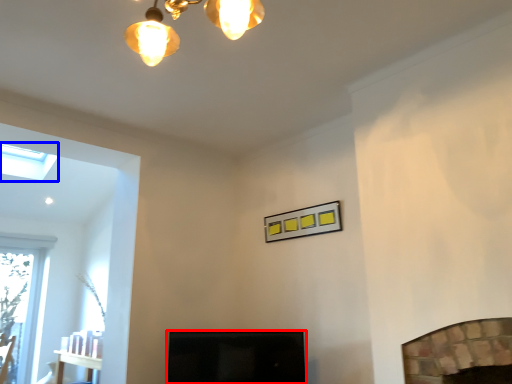
Question: Which point is further to the camera, screen door (highlighted by a red box) or lamp (highlighted by a blue box)?

Choices:
 (A) screen door
 (B) lamp

Answer: (B)